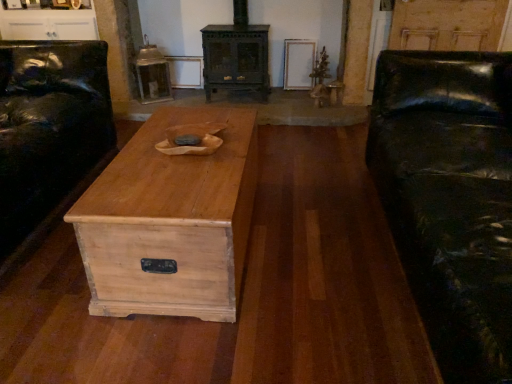
Question: From the image's perspective, is black leather couch at left under natural wood chest at center?

Choices:
 (A) no
 (B) yes

Answer: (A)

Question: Is black leather couch at left shorter than natural wood chest at center?

Choices:
 (A) no
 (B) yes

Answer: (A)

Question: Is black leather couch at left not near natural wood chest at center?

Choices:
 (A) no
 (B) yes

Answer: (A)

Question: Is black leather couch at left taller than natural wood chest at center?

Choices:
 (A) no
 (B) yes

Answer: (B)

Question: Is natural wood chest at center inside black leather couch at left?

Choices:
 (A) no
 (B) yes

Answer: (A)

Question: Does point (39, 16) appear closer or farther from the camera than point (173, 220)?

Choices:
 (A) closer
 (B) farther

Answer: (B)

Question: Is white glossy cabinet at upper left in front of or behind natural wood chest at center in the image?

Choices:
 (A) behind
 (B) front

Answer: (A)

Question: From the image's perspective, is white glossy cabinet at upper left above or below natural wood chest at center?

Choices:
 (A) above
 (B) below

Answer: (A)

Question: In terms of height, does white glossy cabinet at upper left look taller or shorter compared to natural wood chest at center?

Choices:
 (A) tall
 (B) short

Answer: (B)

Question: Is black leather couch at left in front of or behind dark green wood stove at center in the image?

Choices:
 (A) front
 (B) behind

Answer: (A)

Question: From the image's perspective, relative to dark green wood stove at center, is black leather couch at left above or below?

Choices:
 (A) below
 (B) above

Answer: (A)

Question: Is black leather couch at left wider or thinner than dark green wood stove at center?

Choices:
 (A) wide
 (B) thin

Answer: (A)

Question: Is black leather couch at left taller or shorter than dark green wood stove at center?

Choices:
 (A) short
 (B) tall

Answer: (B)

Question: In the image, is natural wood chest at center on the left side or the right side of black leather couch at left?

Choices:
 (A) left
 (B) right

Answer: (B)

Question: Based on their sizes in the image, would you say natural wood chest at center is bigger or smaller than black leather couch at left?

Choices:
 (A) small
 (B) big

Answer: (A)